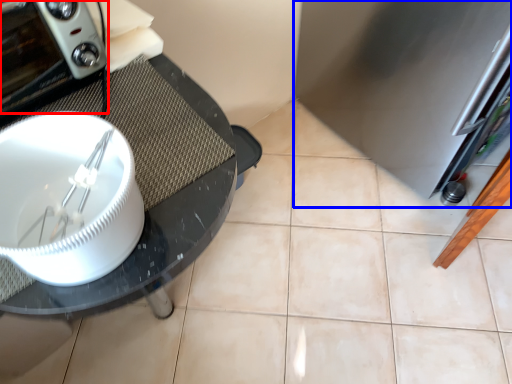
Question: Which point is closer to the camera, home appliance (highlighted by a red box) or appliance (highlighted by a blue box)?

Choices:
 (A) home appliance
 (B) appliance

Answer: (A)